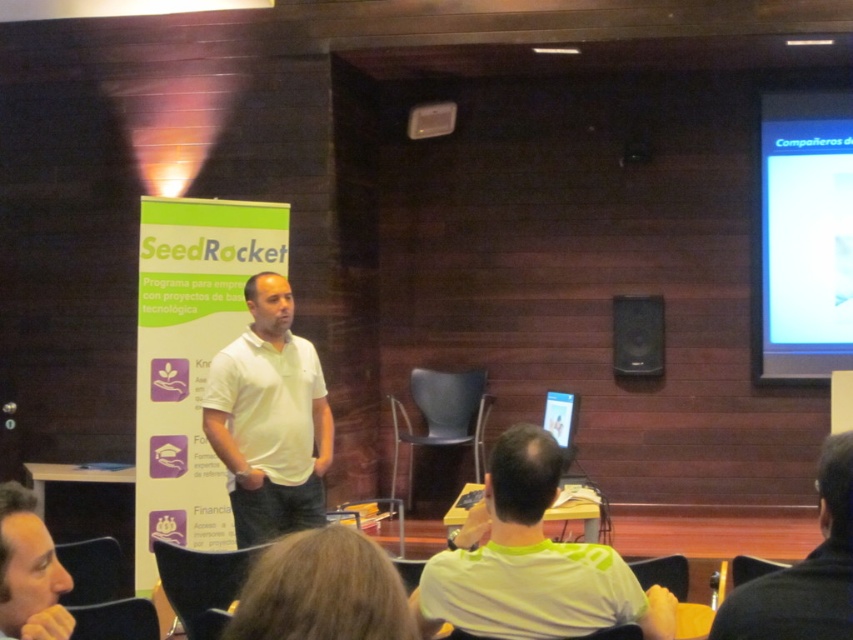
You are an attendee at the presentation and want to know which object is larger between the yellow matte shirt at center and the black plastic speaker at upper center. Can you determine this based on the scene?

The yellow matte shirt at center is bigger than the black plastic speaker at upper center, so the yellow matte shirt at center is larger.

You are attending a presentation in the conference room. You see a point at coordinate (531, 563). What object is located at that point?

The point at coordinate (531, 563) corresponds to the yellow matte shirt at center.

You are an event organizer who needs to set up a microphone stand for the speaker. The stand can extend up to 2 meters tall. Given the distance between the white matte shirt at center and the black plastic speaker at upper center, will the microphone stand be tall enough to reach the speaker?

The white matte shirt at center and black plastic speaker at upper center are 3.22 meters apart from each other. Since the microphone stand can only extend up to 2 meters, it won not be tall enough to reach the speaker.